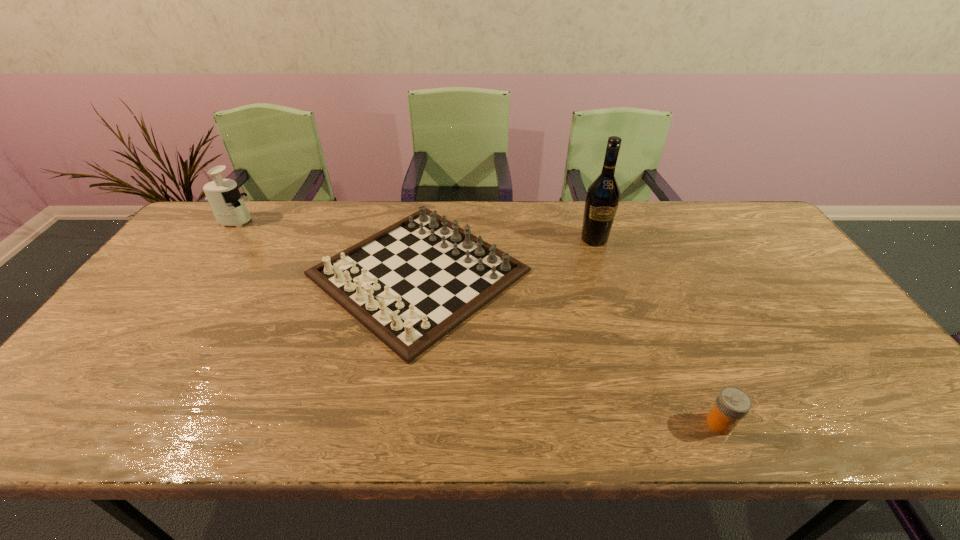
What are the coordinates of `vacant space at the near left corner of the desktop` in the screenshot? It's located at (83, 403).

Locate an element on the screen. free space at the far right corner is located at coordinates (748, 225).

This screenshot has width=960, height=540. Identify the location of free space between the leftmost object and the chessboard. (326, 247).

Find the location of a particular element. unoccupied area between the nearest object and the second object from left to right is located at coordinates (569, 348).

I want to click on empty space between the rightmost object and the wine bottle, so click(657, 331).

I want to click on vacant space that's between the medicine and the tallest object, so click(657, 331).

Identify the location of vacant area between the nearest object and the leftmost object. (477, 322).

The height and width of the screenshot is (540, 960). In order to click on free spot between the chessboard and the leftmost object in this screenshot , I will do `click(326, 247)`.

Locate which object is the third closest to the nearest object. Please provide its 2D coordinates. Your answer should be formatted as a tuple, i.e. [(x, y)], where the tuple contains the x and y coordinates of a point satisfying the conditions above.

[(227, 204)]

What are the coordinates of `object that can be found as the second closest to the tallest object` in the screenshot? It's located at (732, 404).